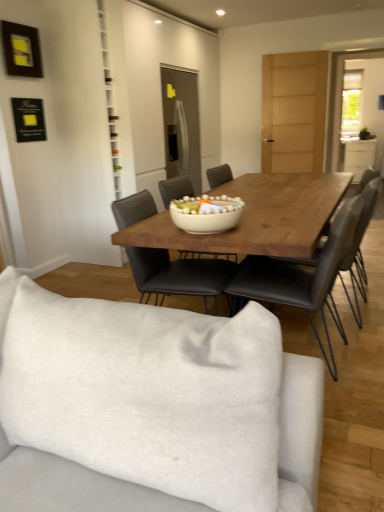
Question: Is clear glass door at upper right taller or shorter than white fabric studio couch at lower center?

Choices:
 (A) short
 (B) tall

Answer: (B)

Question: From the image's perspective, is clear glass door at upper right positioned above or below white fabric studio couch at lower center?

Choices:
 (A) below
 (B) above

Answer: (B)

Question: Based on their relative distances, which object is nearer to the white fabric studio couch at lower center?

Choices:
 (A) clear glass door at upper right
 (B) wooden picture frame at upper left
 (C) white glossy bowl at center
 (D) white glossy cabinet at right

Answer: (C)

Question: Considering the real-world distances, which object is farthest from the clear glass door at upper right?

Choices:
 (A) white fabric studio couch at lower center
 (B) white glossy bowl at center
 (C) white glossy cabinet at right
 (D) wooden picture frame at upper left

Answer: (A)